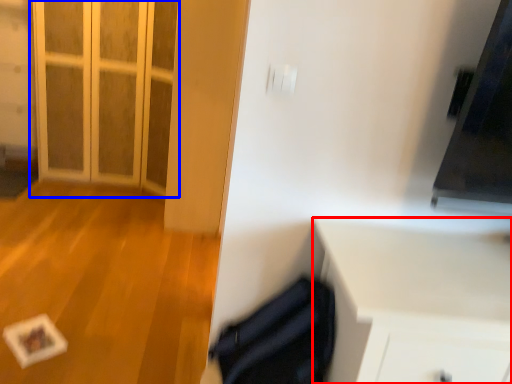
Question: Which object is further to the camera taking this photo, cabinetry (highlighted by a red box) or door (highlighted by a blue box)?

Choices:
 (A) cabinetry
 (B) door

Answer: (B)